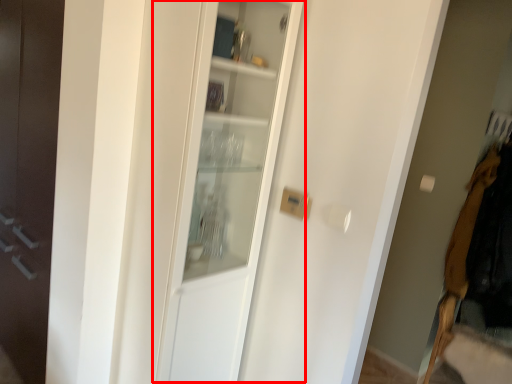
Question: From the image, what is the correct spatial relationship of cabinetry (annotated by the red box) in relation to clothing?

Choices:
 (A) right
 (B) left

Answer: (B)